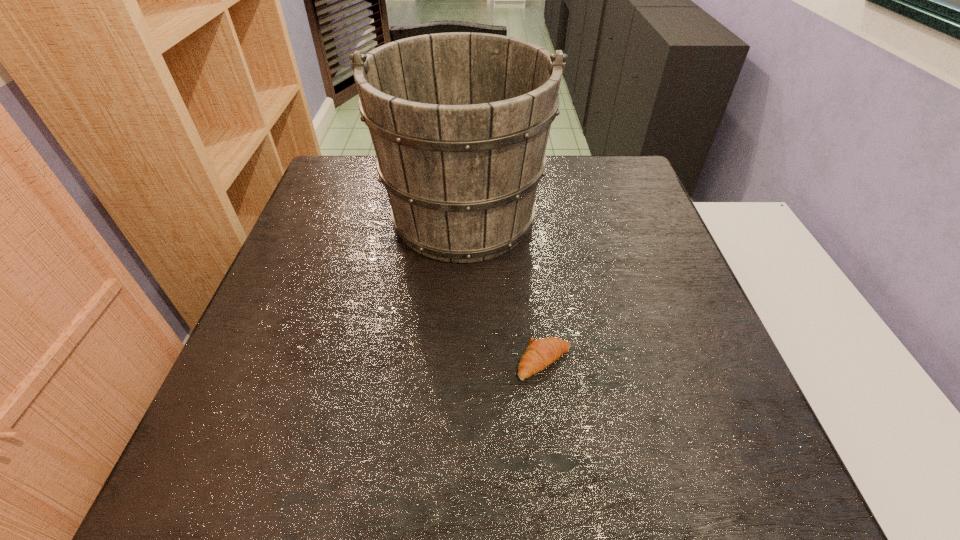
Image resolution: width=960 pixels, height=540 pixels. In the image, there is a desktop. Find the location of `free space at the far right corner`. free space at the far right corner is located at coordinates (620, 176).

This screenshot has width=960, height=540. Find the location of `free space at the near right corner of the desktop`. free space at the near right corner of the desktop is located at coordinates (744, 458).